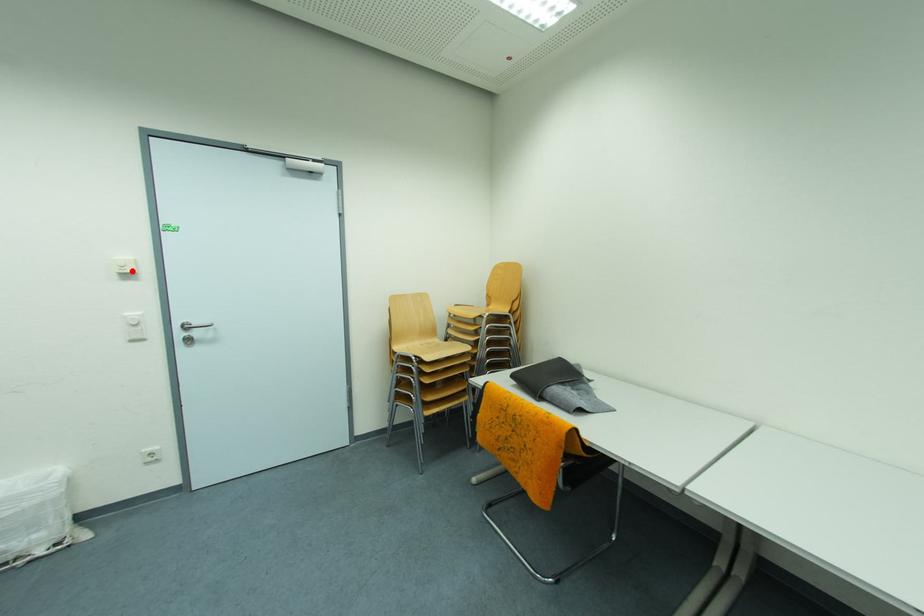
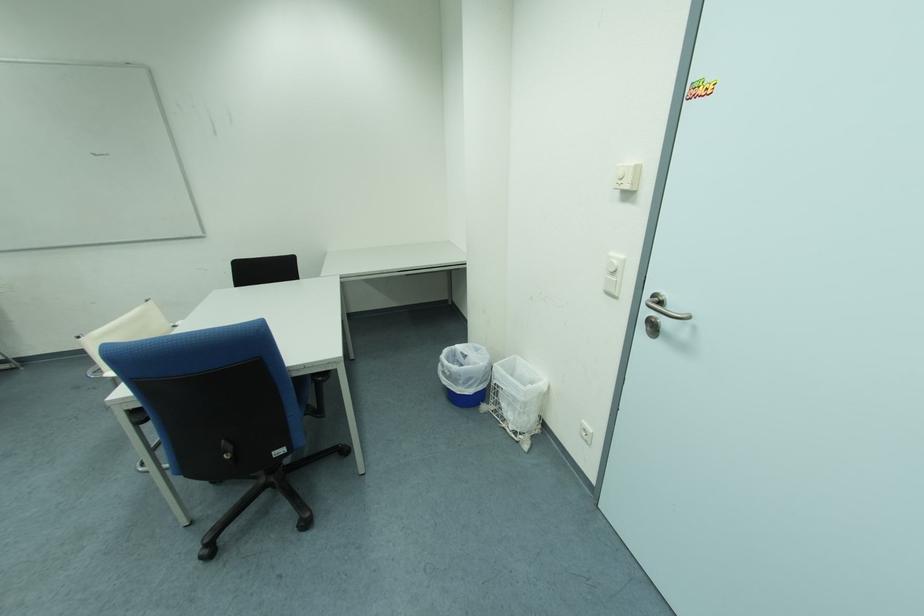
The point at the highlighted location is marked in the first image. Where is the corresponding point in the second image?

(628, 185)